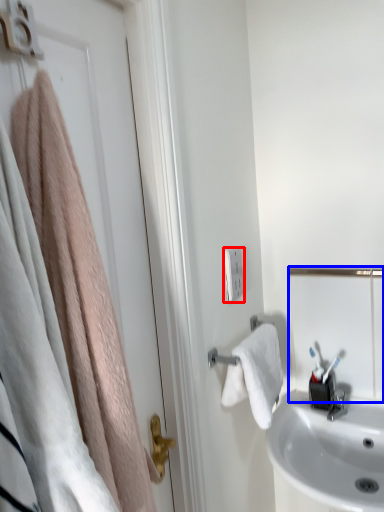
Question: Which object appears farthest to the camera in this image, light switch (highlighted by a red box) or mirror (highlighted by a blue box)?

Choices:
 (A) light switch
 (B) mirror

Answer: (B)